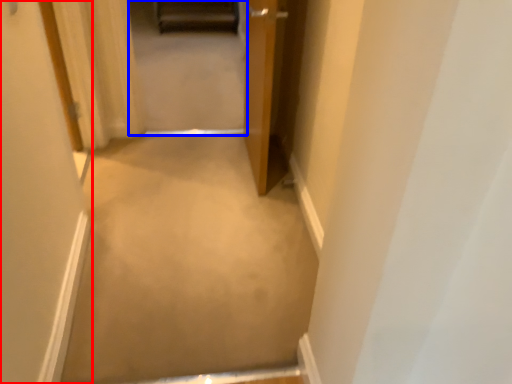
Question: Which point is further to the camera, door (highlighted by a red box) or passage (highlighted by a blue box)?

Choices:
 (A) door
 (B) passage

Answer: (B)